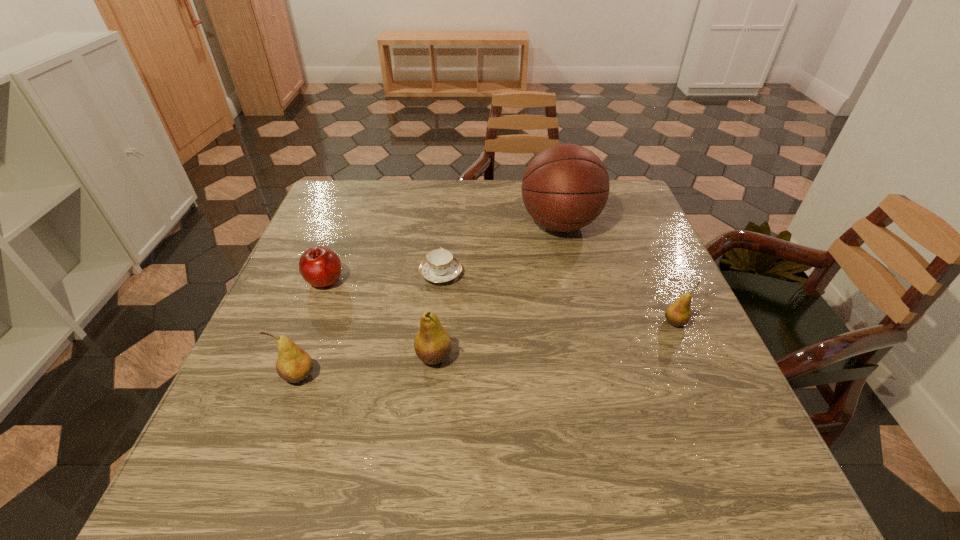
In order to click on free space located on the right of the second tallest pear in this screenshot , I will do `click(383, 375)`.

This screenshot has height=540, width=960. What are the coordinates of `free point located 0.100m on the front of the second pear from left to right` in the screenshot? It's located at (428, 418).

At what (x,y) coordinates should I click in order to perform the action: click on free point located on the back of the rightmost object. Please return your answer as a coordinate pair (x, y). Looking at the image, I should click on (644, 252).

At what (x,y) coordinates should I click in order to perform the action: click on free space located 0.080m on the back of the apple. Please return your answer as a coordinate pair (x, y). This screenshot has height=540, width=960. Looking at the image, I should click on (338, 248).

I want to click on free space located 0.280m on the left of the basketball, so click(420, 224).

This screenshot has height=540, width=960. In order to click on free space located on the side with the handle of the teacup in this screenshot , I will do `click(446, 218)`.

Find the location of a particular element. The width and height of the screenshot is (960, 540). blank space located on the side with the handle of the teacup is located at coordinates pos(450,182).

Where is `vacant space located 0.350m on the side with the handle of the teacup`? The width and height of the screenshot is (960, 540). vacant space located 0.350m on the side with the handle of the teacup is located at coordinates (449, 188).

Find the location of `object positioned at the far edge`. object positioned at the far edge is located at coordinates (565, 187).

This screenshot has height=540, width=960. I want to click on pear that is at the left edge, so coord(293,364).